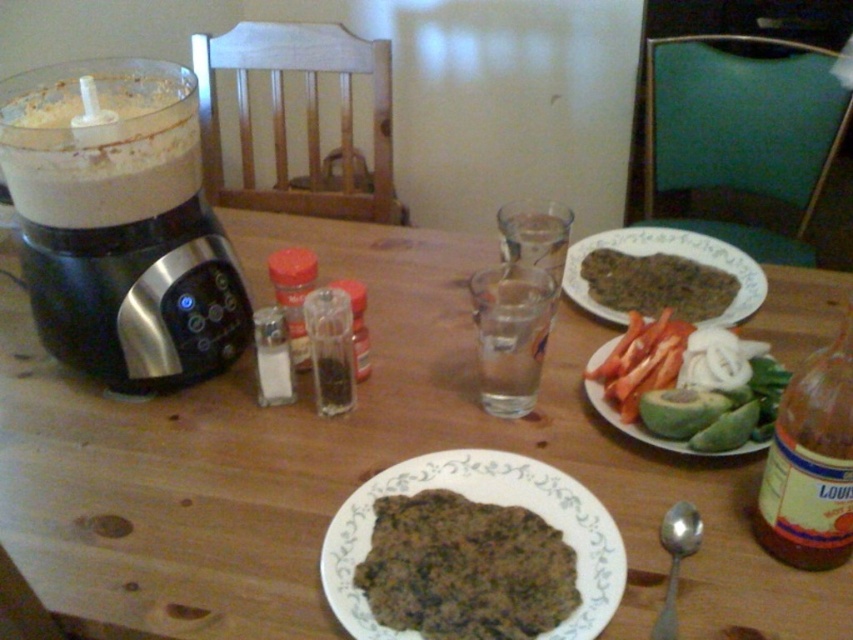
You are setting up a table for a dinner party and need to arrange items so that the tallest object is placed at the center. Currently, you have a brown glass bottle at right and clear glass water at center. Which item should you move to the center to comply with this requirement?

The brown glass bottle at right is taller than the clear glass water at center, so you should move the brown glass bottle at right to the center to make it the tallest object there.

You are setting up a dinner table and want to place a decorative item between the brown glass bottle at right and the clear glass water at center. Which object should you place the item closer to if you want it to be more visible due to its width?

The brown glass bottle at right is wider than the clear glass water at center, so placing the decorative item closer to the brown glass bottle at right would make it more visible due to its width.